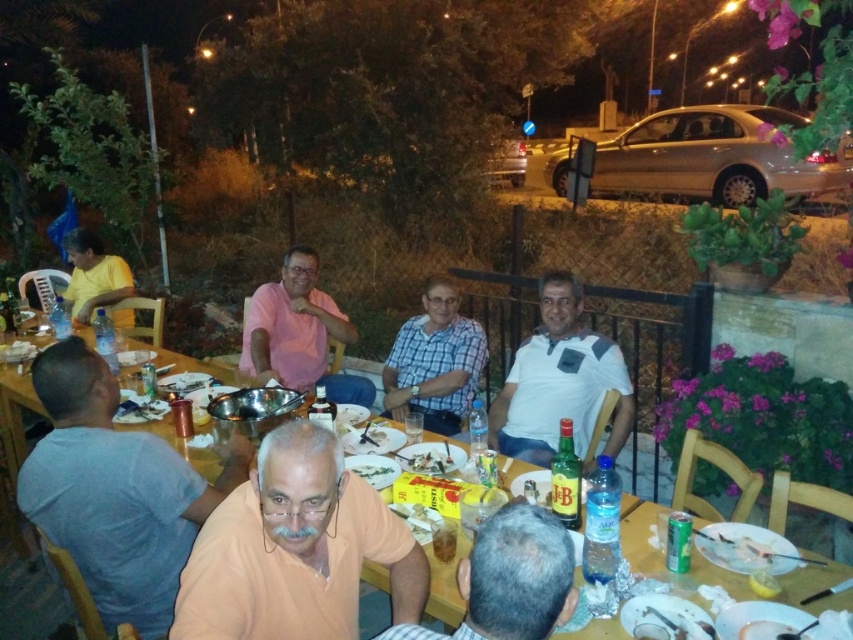
Question: Which point is closer to the camera taking this photo?

Choices:
 (A) (80, 540)
 (B) (618, 388)
 (C) (440, 378)
 (D) (312, 368)

Answer: (A)

Question: Can you confirm if white matte shirt at center is positioned to the left of checkered fabric shirt at center?

Choices:
 (A) yes
 (B) no

Answer: (B)

Question: Which of the following is the closest to the observer?

Choices:
 (A) matte yellow shirt at left
 (B) white paper plate at center
 (C) pink matte shirt at center
 (D) checkered fabric shirt at center

Answer: (B)

Question: Can you confirm if blue cotton shirt at left is positioned to the left of light brown leather chair at lower center?

Choices:
 (A) no
 (B) yes

Answer: (B)

Question: Does orange matte shirt at center appear on the right side of pink matte shirt at center?

Choices:
 (A) no
 (B) yes

Answer: (B)

Question: Among these points, which one is nearest to the camera?

Choices:
 (A) (83, 278)
 (B) (445, 595)
 (C) (430, 464)

Answer: (B)